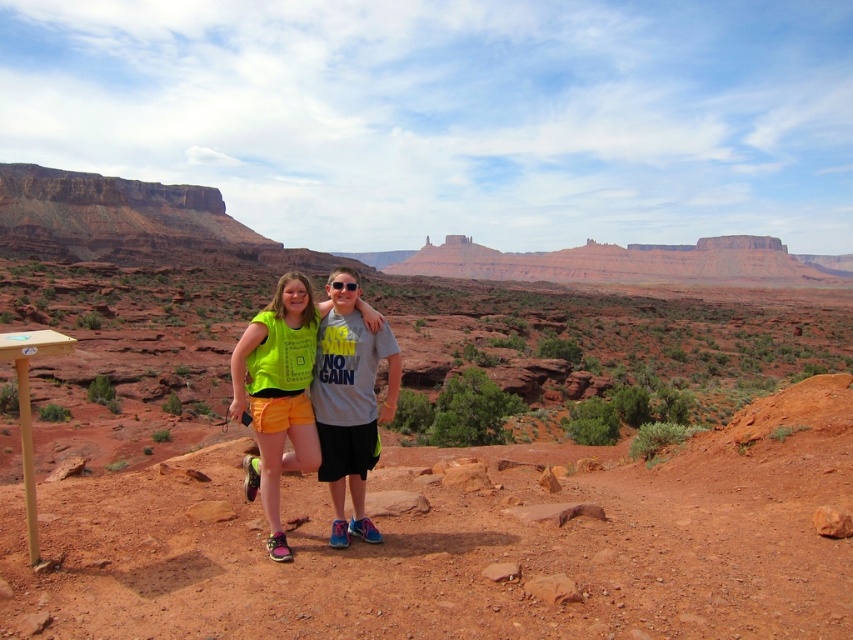
You are a photographer trying to capture the neon yellow fabric at center and glossy plastic goggles at center in the same frame. Given that your camera has a fixed focal length, which object should you position closer to the center of the frame to ensure both fit within the shot?

The neon yellow fabric at center is wider than the glossy plastic goggles at center. To ensure both fit within the shot, position the neon yellow fabric at center closer to the center of the frame since its greater width requires more space in the composition.

You are standing at the camera position and want to reach the point at coordinates (335, 486). If you walk straight ahead, will you reach that point before walking 30 meters?

The point at coordinates (335, 486) is 35.83 meters away from the camera. Since you need to walk 35.83 meters to reach it, which is more than 30 meters, you will not reach the point before walking 30 meters.